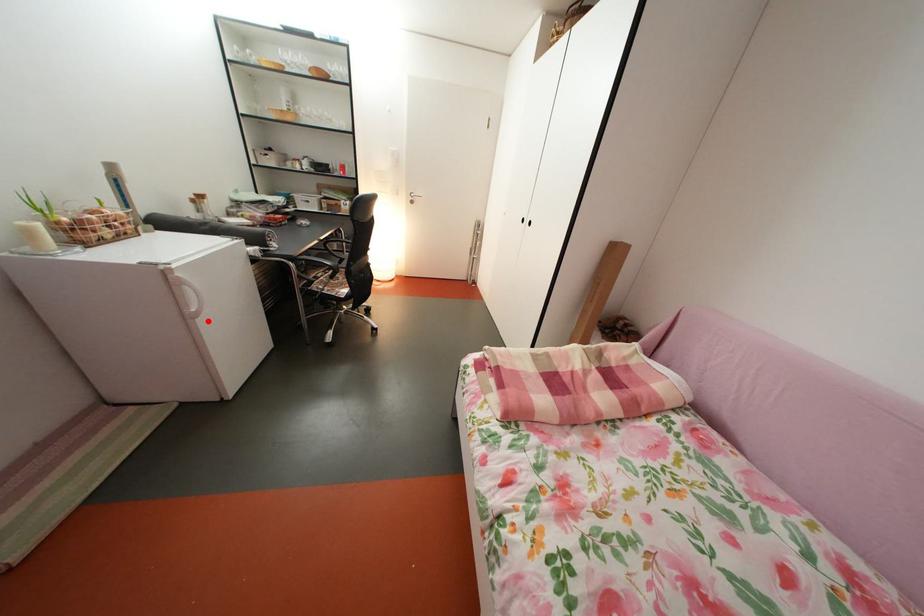
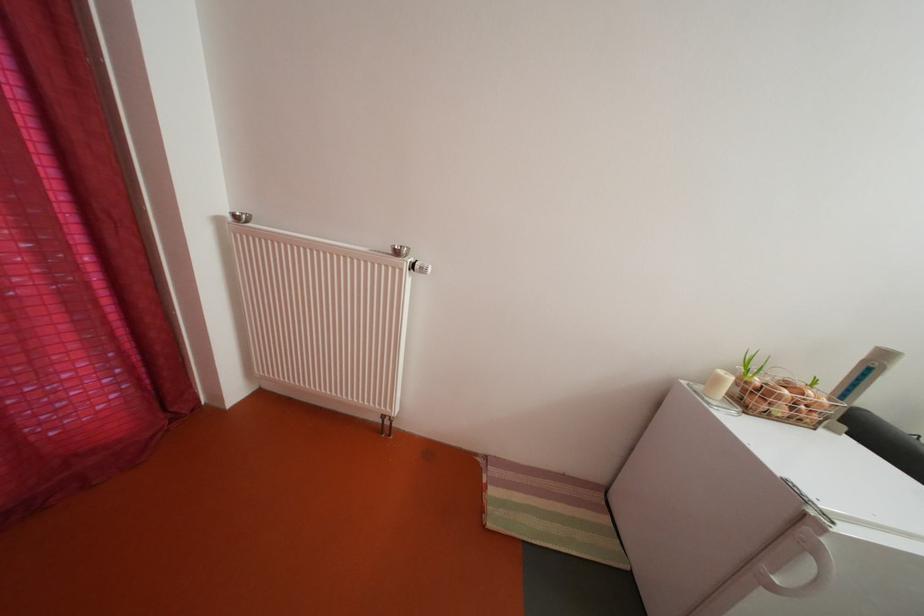
In the second image, find the point that corresponds to the highlighted location in the first image.

(784, 594)